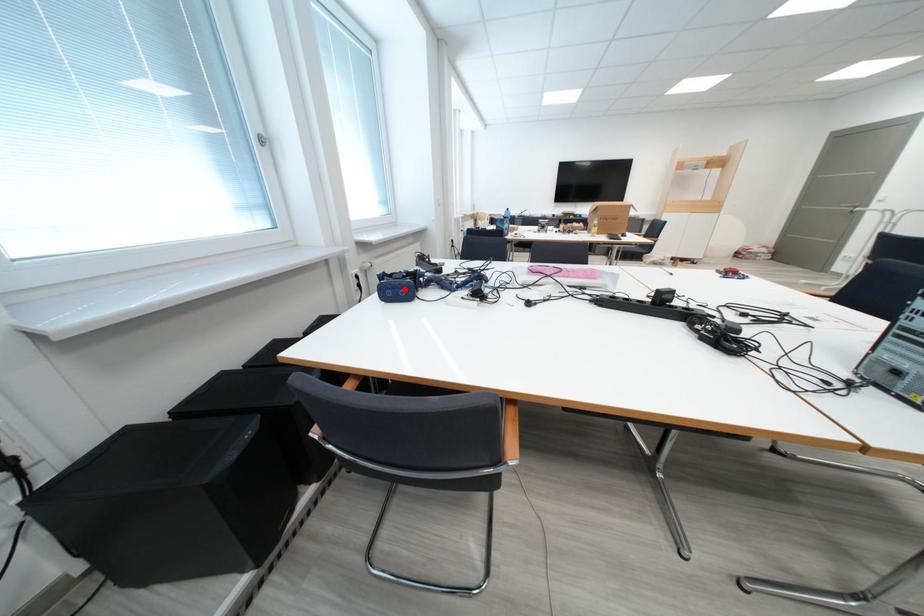
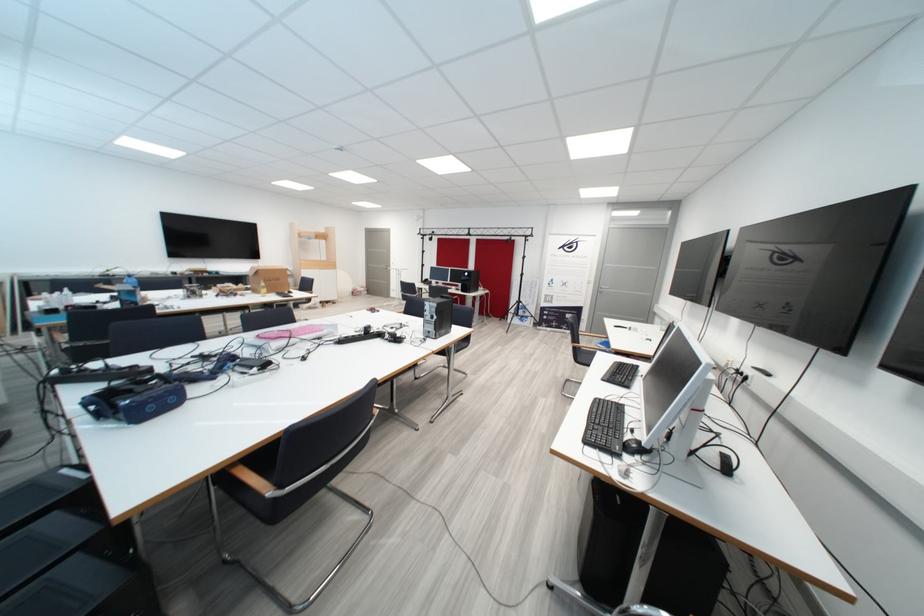
Question: A red point is marked in image1. In image2, is the corresponding 3D point closer to the camera or farther? Reply with the corresponding letter.

Choices:
 (A) The corresponding 3D point is closer.
 (B) The corresponding 3D point is farther.

Answer: (B)